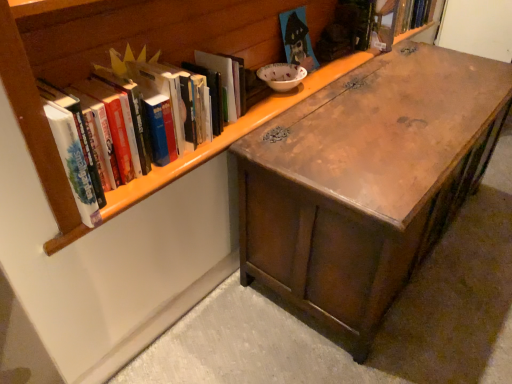
Question: From a real-world perspective, is wooden bookshelf at upper left positioned above or below hardcover book at upper right, the 3th book from the bottom?

Choices:
 (A) above
 (B) below

Answer: (A)

Question: Looking at the image, does wooden bookshelf at upper left seem bigger or smaller compared to hardcover book at upper right, the 3th book from the left?

Choices:
 (A) big
 (B) small

Answer: (A)

Question: Estimate the real-world distances between objects in this image. Which object is closer to the white matte book at upper left, the first book when ordered from left to right?

Choices:
 (A) wooden chest at center
 (B) hardcover book at upper right, the 3th book from the left
 (C) wooden bookshelf at upper left
 (D) wooden house-shaped book at upper center, which is the second book from back to front

Answer: (C)

Question: Which is nearer to the wooden house-shaped book at upper center, which is counted as the 2th book, starting from the top?

Choices:
 (A) white matte book at upper left, which is the first book from front to back
 (B) wooden chest at center
 (C) hardcover book at upper right, which ranks as the 1th book in top-to-bottom order
 (D) wooden bookshelf at upper left

Answer: (D)